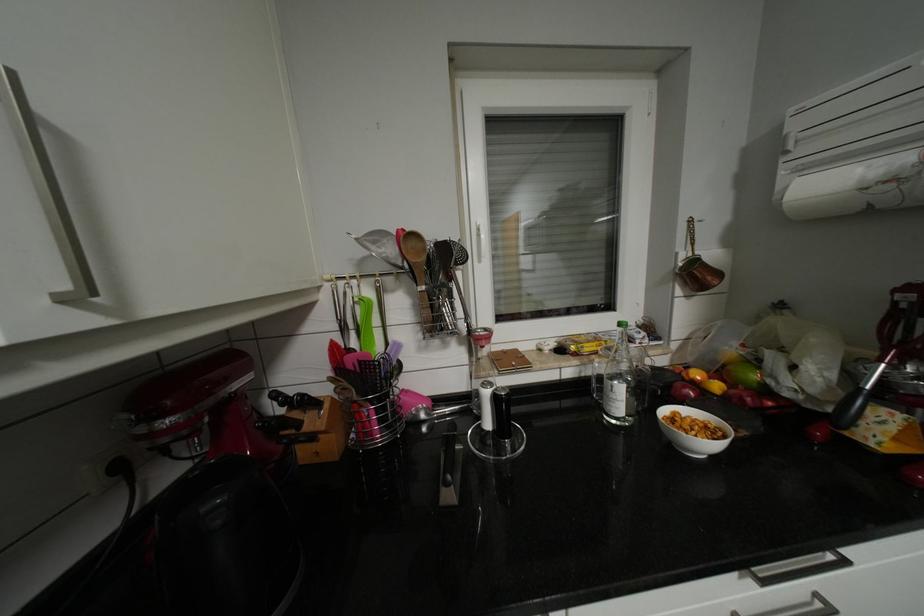
I want to click on knife handle, so click(450, 467).